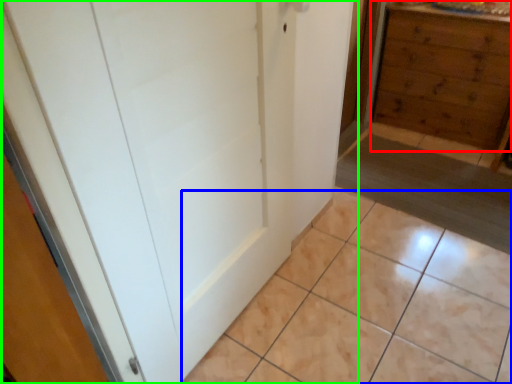
Question: Which object is positioned closest to chest of drawers (highlighted by a red box)? Select from ceramic tile (highlighted by a blue box) and door (highlighted by a green box).

Choices:
 (A) ceramic tile
 (B) door

Answer: (A)